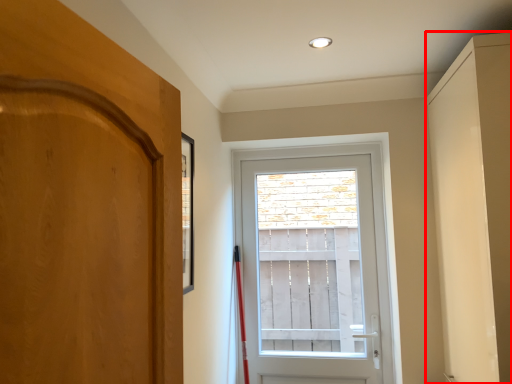
Question: From the image's perspective, where is cabinetry (annotated by the red box) located relative to door?

Choices:
 (A) below
 (B) above

Answer: (B)